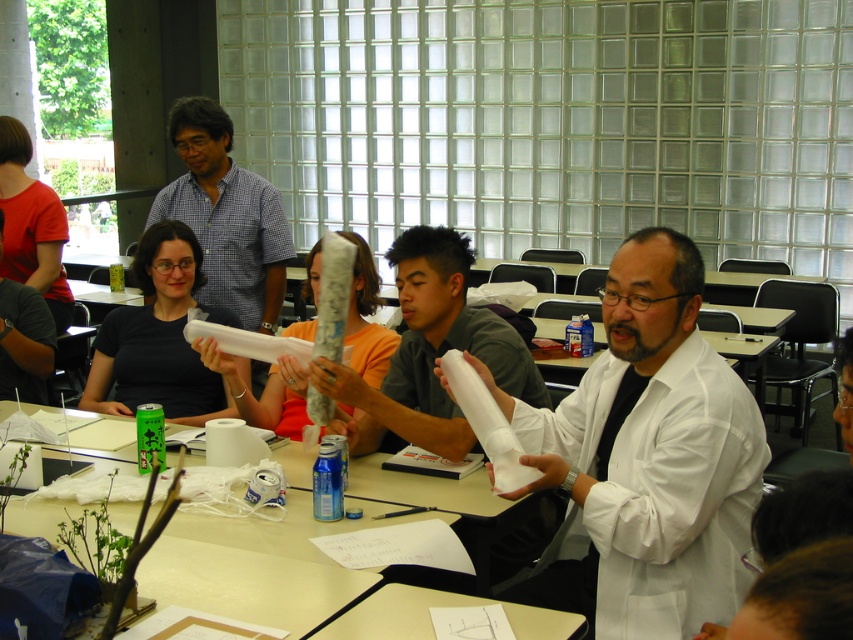
You are a student in the classroom looking at the white matte lab coat at center and the matte gray paper towel at center. Which object is positioned lower in the image?

The white matte lab coat at center is located below the matte gray paper towel at center, so it is positioned lower in the image.

You are a student in the classroom and need to retrieve the white paper at center. Can you reach it without moving the white matte lab coat at center?

The white matte lab coat at center is above the white paper at center, so you cannot reach the white paper at center without moving the lab coat first.

Consider the image. You are organizing a classroom event and need to place a decorative item between the matte gray paper towel at center and the white paper at center. The decorative item requires a minimum of 1 meter of space between them. Based on the scene description, will there be enough space?

The matte gray paper towel at center is 82.90 centimeters from the white paper at center. Since 82.90 centimeters is less than 1 meter, there is not enough space to place the decorative item between them.